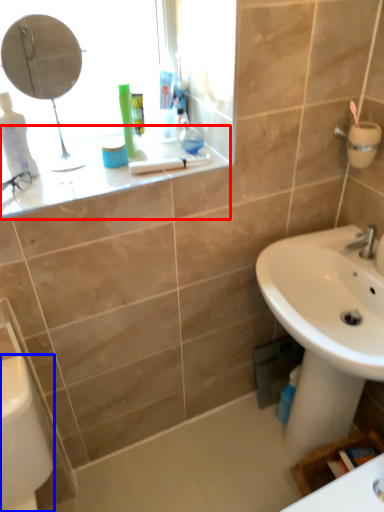
Question: Which object appears farthest to the camera in this image, counter top (highlighted by a red box) or porcelain (highlighted by a blue box)?

Choices:
 (A) counter top
 (B) porcelain

Answer: (A)